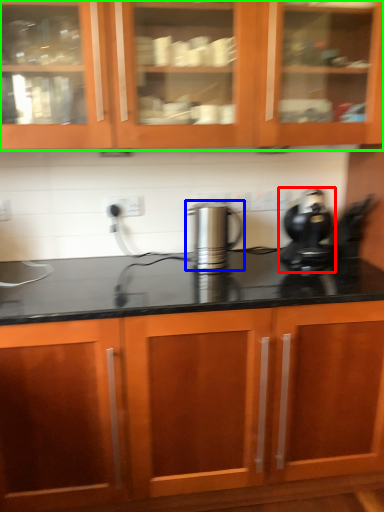
Question: Which object is positioned farthest from home appliance (highlighted by a red box)? Select from kitchen appliance (highlighted by a blue box) and cabinetry (highlighted by a green box).

Choices:
 (A) kitchen appliance
 (B) cabinetry

Answer: (B)